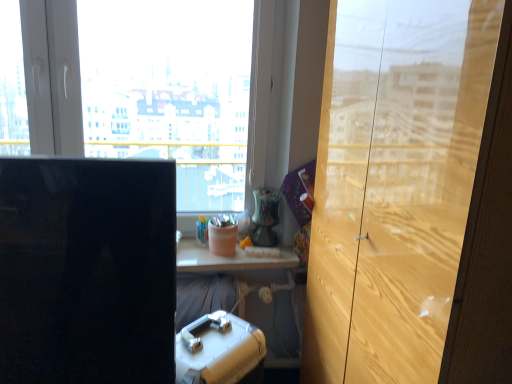
Locate an element on the screen. pink matte container at center, positioned as the 2th stationery in back-to-front order is located at coordinates pyautogui.click(x=222, y=235).

I want to click on wooden cabinet at right, so coord(400,185).

Locate an element on the screen. The width and height of the screenshot is (512, 384). white plastic suitcase at lower center, the third stationery positioned from the top is located at coordinates [x=219, y=351].

Locate an element on the screen. matte plastic cup at center, arranged as the 1th stationery when viewed from the top is located at coordinates (202, 230).

Is wooden cabinet at right inside the boundaries of transparent glass window at center, or outside?

wooden cabinet at right is outside transparent glass window at center.

Is wooden cabinet at right not near transparent glass window at center?

No.

Considering the relative sizes of wooden cabinet at right and transparent glass window at center in the image provided, is wooden cabinet at right wider than transparent glass window at center?

Yes, wooden cabinet at right is wider than transparent glass window at center.

From the image's perspective, between wooden cabinet at right and transparent glass window at center, which one is located above?

transparent glass window at center appears higher in the image.

From the image's perspective, which is below, wooden cabinet at right or black glossy computer monitor at left?

black glossy computer monitor at left, from the image's perspective.

Is wooden cabinet at right inside the boundaries of black glossy computer monitor at left, or outside?

wooden cabinet at right is outside black glossy computer monitor at left.

Which object is positioned more to the right, wooden cabinet at right or black glossy computer monitor at left?

From the viewer's perspective, wooden cabinet at right appears more on the right side.

From the picture: Can we say transparent glass window at center lies outside matte plastic cup at center, arranged as the 1th stationery when viewed from the top?

That's correct, transparent glass window at center is outside of matte plastic cup at center, arranged as the 1th stationery when viewed from the top.

Considering their positions, is transparent glass window at center located in front of or behind matte plastic cup at center, which is counted as the first stationery, starting from the back?

transparent glass window at center is in front of matte plastic cup at center, which is counted as the first stationery, starting from the back.

From the image's perspective, is transparent glass window at center located above or below matte plastic cup at center, arranged as the 1th stationery when viewed from the top?

Clearly, from the image's perspective, transparent glass window at center is above matte plastic cup at center, arranged as the 1th stationery when viewed from the top.

How different are the orientations of transparent glass window at center and matte plastic cup at center, which is counted as the first stationery, starting from the back, in degrees?

0.369 degrees separate the facing orientations of transparent glass window at center and matte plastic cup at center, which is counted as the first stationery, starting from the back.

Can you confirm if transparent glass window at center is thinner than black glossy computer monitor at left?

Indeed, transparent glass window at center has a lesser width compared to black glossy computer monitor at left.

Is transparent glass window at center behind black glossy computer monitor at left?

Yes, the depth of transparent glass window at center is greater than that of black glossy computer monitor at left.

How many degrees apart are the facing directions of transparent glass window at center and black glossy computer monitor at left?

5.74 degrees.

In the scene shown: Is transparent glass window at center facing towards black glossy computer monitor at left?

Yes, transparent glass window at center is aimed at black glossy computer monitor at left.

Is pink matte container at center, positioned as the 2th stationery in front-to-back order, bigger or smaller than white plastic suitcase at lower center, the third stationery positioned from the top?

In the image, pink matte container at center, positioned as the 2th stationery in front-to-back order, appears to be smaller than white plastic suitcase at lower center, the third stationery positioned from the top.

Is point (225, 252) behind point (214, 335)?

Yes, it is.

Are pink matte container at center, which is counted as the 2th stationery, starting from the bottom, and white plastic suitcase at lower center, the third stationery positioned from the top, far apart?

No, pink matte container at center, which is counted as the 2th stationery, starting from the bottom, is not far away from white plastic suitcase at lower center, the third stationery positioned from the top.

From the image's perspective, is transparent glass window at center over pink matte container at center, which is counted as the 2th stationery, starting from the bottom?

Yes, from the image's perspective, transparent glass window at center is above pink matte container at center, which is counted as the 2th stationery, starting from the bottom.

How many degrees apart are the facing directions of transparent glass window at center and pink matte container at center, positioned as the 2th stationery in back-to-front order?

There is a 0.369-degree angle between the facing directions of transparent glass window at center and pink matte container at center, positioned as the 2th stationery in back-to-front order.

Is transparent glass window at center inside or outside of pink matte container at center, the 2th stationery when ordered from top to bottom?

transparent glass window at center lies outside pink matte container at center, the 2th stationery when ordered from top to bottom.

Consider the image. From a real-world perspective, is transparent glass window at center above or below pink matte container at center, which is counted as the 2th stationery, starting from the bottom?

Clearly, from a real-world perspective, transparent glass window at center is above pink matte container at center, which is counted as the 2th stationery, starting from the bottom.

Is the surface of white plastic suitcase at lower center, which ranks as the first stationery in front-to-back order, in direct contact with matte plastic cup at center, which is counted as the first stationery, starting from the back?

No, white plastic suitcase at lower center, which ranks as the first stationery in front-to-back order, is not making contact with matte plastic cup at center, which is counted as the first stationery, starting from the back.

Where is `stationery that is the 1st object above the white plastic suitcase at lower center, the third stationery positioned from the top (from a real-world perspective)`? The image size is (512, 384). stationery that is the 1st object above the white plastic suitcase at lower center, the third stationery positioned from the top (from a real-world perspective) is located at coordinates 202,230.

Can you confirm if white plastic suitcase at lower center, which ranks as the first stationery in front-to-back order, is shorter than matte plastic cup at center, arranged as the 1th stationery when viewed from the top?

In fact, white plastic suitcase at lower center, which ranks as the first stationery in front-to-back order, may be taller than matte plastic cup at center, arranged as the 1th stationery when viewed from the top.

Looking at their sizes, would you say white plastic suitcase at lower center, which ranks as the first stationery in front-to-back order, is wider or thinner than matte plastic cup at center, which is counted as the third stationery, starting from the front?

white plastic suitcase at lower center, which ranks as the first stationery in front-to-back order, is wider than matte plastic cup at center, which is counted as the third stationery, starting from the front.

Where is `cupboard located in front of the transparent glass window at center`? cupboard located in front of the transparent glass window at center is located at coordinates (400, 185).

This screenshot has height=384, width=512. Find the location of `computer monitor that is under the wooden cabinet at right (from a real-world perspective)`. computer monitor that is under the wooden cabinet at right (from a real-world perspective) is located at coordinates (87, 271).

Looking at the image, which one is located further to pink matte container at center, positioned as the 2th stationery in back-to-front order, transparent glass window at center or matte plastic cup at center, which is counted as the first stationery, starting from the back?

transparent glass window at center.

Estimate the real-world distances between objects in this image. Which object is further from white plastic suitcase at lower center, which is the first stationery from bottom to top, wooden cabinet at right or transparent glass window at center?

The object further to white plastic suitcase at lower center, which is the first stationery from bottom to top, is transparent glass window at center.

Considering their positions, is transparent glass window at center positioned further to white plastic suitcase at lower center, the third stationery positioned from the top, than matte plastic cup at center, acting as the 3th stationery starting from the bottom?

transparent glass window at center is further to white plastic suitcase at lower center, the third stationery positioned from the top.

Which object lies nearer to the anchor point matte plastic cup at center, arranged as the 1th stationery when viewed from the top, white plastic suitcase at lower center, the third stationery positioned from the top, or black glossy computer monitor at left?

Based on the image, white plastic suitcase at lower center, the third stationery positioned from the top, appears to be nearer to matte plastic cup at center, arranged as the 1th stationery when viewed from the top.

Looking at the image, which one is located closer to matte plastic cup at center, which is counted as the first stationery, starting from the back, transparent glass window at center or wooden cabinet at right?

Based on the image, transparent glass window at center appears to be nearer to matte plastic cup at center, which is counted as the first stationery, starting from the back.

When comparing their distances from pink matte container at center, positioned as the 2th stationery in front-to-back order, does matte plastic cup at center, arranged as the 1th stationery when viewed from the top, or wooden cabinet at right seem closer?

matte plastic cup at center, arranged as the 1th stationery when viewed from the top.

Looking at this image, based on their spatial positions, is transparent glass window at center or white plastic suitcase at lower center, which ranks as the first stationery in front-to-back order, closer to wooden cabinet at right?

white plastic suitcase at lower center, which ranks as the first stationery in front-to-back order, lies closer to wooden cabinet at right than the other object.

Which object lies nearer to the anchor point black glossy computer monitor at left, matte plastic cup at center, acting as the 3th stationery starting from the bottom, or white plastic suitcase at lower center, the third stationery positioned from the top?

white plastic suitcase at lower center, the third stationery positioned from the top, is closer to black glossy computer monitor at left.

The height and width of the screenshot is (384, 512). Identify the location of stationery between black glossy computer monitor at left and pink matte container at center, positioned as the 2th stationery in front-to-back order, in the front-back direction. (219, 351).

Where is `stationery between white plastic suitcase at lower center, the third stationery positioned from the top, and matte plastic cup at center, which is counted as the first stationery, starting from the back, from front to back`? This screenshot has height=384, width=512. stationery between white plastic suitcase at lower center, the third stationery positioned from the top, and matte plastic cup at center, which is counted as the first stationery, starting from the back, from front to back is located at coordinates (222, 235).

I want to click on stationery positioned between wooden cabinet at right and pink matte container at center, positioned as the 2th stationery in front-to-back order, from near to far, so click(219, 351).

The width and height of the screenshot is (512, 384). Find the location of `window located between black glossy computer monitor at left and wooden cabinet at right in the left-right direction`. window located between black glossy computer monitor at left and wooden cabinet at right in the left-right direction is located at coordinates (139, 88).